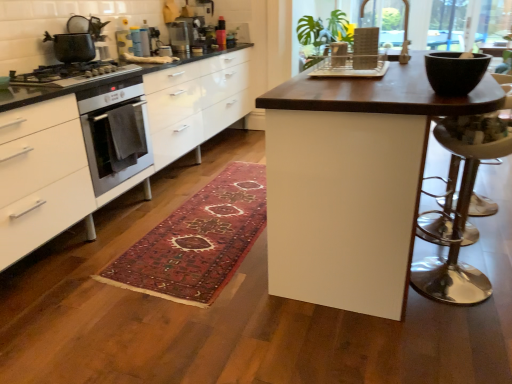
Identify the location of metallic silver toaster at upper center, positioned as the 2th appliance in front-to-back order. (140, 41).

The width and height of the screenshot is (512, 384). What do you see at coordinates (140, 41) in the screenshot? I see `metallic silver toaster at upper center, positioned as the 2th appliance in front-to-back order` at bounding box center [140, 41].

Locate an element on the screen. white glossy cabinets at left is located at coordinates (101, 146).

Locate an element on the screen. This screenshot has width=512, height=384. metallic silver toaster at upper center, positioned as the 2th appliance in front-to-back order is located at coordinates (140, 41).

Between point (501, 153) and point (364, 94), which one is positioned in front?

Positioned in front is point (364, 94).

Considering the sizes of objects polished silver bar stool at right and dark wood table at center in the image provided, who is bigger, polished silver bar stool at right or dark wood table at center?

dark wood table at center.

Considering the positions of objects polished silver bar stool at right and dark wood table at center in the image provided, who is behind, polished silver bar stool at right or dark wood table at center?

polished silver bar stool at right is more distant.

Is metallic silver toaster at upper center, the second appliance positioned from the top, in front of or behind dark wood table at center in the image?

metallic silver toaster at upper center, the second appliance positioned from the top, is positioned farther from the viewer than dark wood table at center.

This screenshot has height=384, width=512. Find the location of `table that appears below the metallic silver toaster at upper center, marked as the first appliance in a left-to-right arrangement (from a real-world perspective)`. table that appears below the metallic silver toaster at upper center, marked as the first appliance in a left-to-right arrangement (from a real-world perspective) is located at coordinates (352, 182).

Can you confirm if metallic silver toaster at upper center, the second appliance when ordered from back to front, is shorter than dark wood table at center?

Correct, metallic silver toaster at upper center, the second appliance when ordered from back to front, is not as tall as dark wood table at center.

Does matte black gas stove at left have a lesser width compared to translucent plastic blender at upper center, the second appliance positioned from the left?

In fact, matte black gas stove at left might be wider than translucent plastic blender at upper center, the second appliance positioned from the left.

Which object is positioned more to the left, matte black gas stove at left or translucent plastic blender at upper center, placed as the 2th appliance when sorted from right to left?

From the viewer's perspective, matte black gas stove at left appears more on the left side.

Are matte black gas stove at left and translucent plastic blender at upper center, placed as the 2th appliance when sorted from right to left, far apart?

Absolutely, matte black gas stove at left is distant from translucent plastic blender at upper center, placed as the 2th appliance when sorted from right to left.

From the image's perspective, does matte black gas stove at left appear lower than translucent plastic blender at upper center, placed as the 2th appliance when sorted from right to left?

Indeed, from the image's perspective, matte black gas stove at left is shown beneath translucent plastic blender at upper center, placed as the 2th appliance when sorted from right to left.

Can you confirm if wooden lattice at upper right is bigger than matte plastic dish rack at center, placed as the first appliance when sorted from bottom to top?

Yes.

From a real-world perspective, does wooden lattice at upper right stand above matte plastic dish rack at center, which is counted as the first appliance, starting from the front?

Yes, from a real-world perspective, wooden lattice at upper right is on top of matte plastic dish rack at center, which is counted as the first appliance, starting from the front.

Is wooden lattice at upper right facing away from matte plastic dish rack at center, which is counted as the 3th appliance, starting from the back?

No, matte plastic dish rack at center, which is counted as the 3th appliance, starting from the back, is not at the back of wooden lattice at upper right.

Consider the image. In the image, is dark wood table at center on the left side or the right side of metallic silver toaster at upper center, the second appliance when ordered from back to front?

Clearly, dark wood table at center is on the right of metallic silver toaster at upper center, the second appliance when ordered from back to front, in the image.

Is dark wood table at center oriented away from metallic silver toaster at upper center, acting as the 3th appliance starting from the right?

Yes, dark wood table at center's orientation is away from metallic silver toaster at upper center, acting as the 3th appliance starting from the right.

In the scene shown: Considering the relative sizes of dark wood table at center and metallic silver toaster at upper center, acting as the 3th appliance starting from the right, in the image provided, is dark wood table at center taller than metallic silver toaster at upper center, acting as the 3th appliance starting from the right,?

Indeed, dark wood table at center has a greater height compared to metallic silver toaster at upper center, acting as the 3th appliance starting from the right.

From a real-world perspective, does dark wood table at center stand above metallic silver toaster at upper center, the second appliance when ordered from back to front?

No, from a real-world perspective, dark wood table at center is not above metallic silver toaster at upper center, the second appliance when ordered from back to front.

Is metallic silver toaster at upper center, marked as the 2th appliance in a bottom-to-top arrangement, aimed at wooden lattice at upper right?

Yes, metallic silver toaster at upper center, marked as the 2th appliance in a bottom-to-top arrangement, is turned towards wooden lattice at upper right.

Could you measure the distance between metallic silver toaster at upper center, positioned as the 2th appliance in front-to-back order, and wooden lattice at upper right?

The distance of metallic silver toaster at upper center, positioned as the 2th appliance in front-to-back order, from wooden lattice at upper right is 6.46 feet.

Where is `the 1st appliance behind the wooden lattice at upper right, starting your count from the anchor`? This screenshot has width=512, height=384. the 1st appliance behind the wooden lattice at upper right, starting your count from the anchor is located at coordinates (140, 41).

Is carpeted rug at center in front of matte black gas stove at left?

Yes, carpeted rug at center is closer to the viewer.

How much distance is there between carpeted rug at center and matte black gas stove at left?

3.42 feet.

Considering the relative sizes of carpeted rug at center and matte black gas stove at left in the image provided, is carpeted rug at center bigger than matte black gas stove at left?

Yes.

Considering the positions of point (182, 235) and point (20, 74), is point (182, 235) closer or farther from the camera than point (20, 74)?

Point (182, 235).

Identify the location of bar stool below the dark wood table at center (from the image's perspective). The height and width of the screenshot is (384, 512). (458, 231).

Which appliance is the 2nd one when counting from the back of the dark wood table at center? Please provide its 2D coordinates.

[(140, 41)]

Which object lies further to the anchor point wooden lattice at upper right, metallic silver toaster at upper center, marked as the first appliance in a left-to-right arrangement, or matte black pot at upper left?

The object further to wooden lattice at upper right is matte black pot at upper left.

Based on their spatial positions, is wooden lattice at upper right or carpeted rug at center further from translucent plastic blender at upper center, arranged as the first appliance when viewed from the back?

Among the two, wooden lattice at upper right is located further to translucent plastic blender at upper center, arranged as the first appliance when viewed from the back.

Based on their spatial positions, is matte plastic dish rack at center, placed as the first appliance when sorted from bottom to top, or polished silver bar stool at right further from white glossy cabinets at left?

Among the two, polished silver bar stool at right is located further to white glossy cabinets at left.

In the scene shown: Looking at the image, which one is located closer to wooden lattice at upper right, black matte bowl at upper right or white glossy cabinets at left?

Based on the image, black matte bowl at upper right appears to be nearer to wooden lattice at upper right.

From the image, which object appears to be farther from polished silver bar stool at right, translucent plastic blender at upper center, arranged as the first appliance when viewed from the back, or matte black gas stove at left?

translucent plastic blender at upper center, arranged as the first appliance when viewed from the back, lies further to polished silver bar stool at right than the other object.

Consider the image. Estimate the real-world distances between objects in this image. Which object is further from white glossy cabinets at left, black matte bowl at upper right or carpeted rug at center?

The object further to white glossy cabinets at left is black matte bowl at upper right.

From the image, which object appears to be farther from matte black pot at upper left, wooden lattice at upper right or dark wood table at center?

wooden lattice at upper right lies further to matte black pot at upper left than the other object.

Estimate the real-world distances between objects in this image. Which object is closer to matte black gas stove at left, wooden lattice at upper right or matte black pot at upper left?

The object closer to matte black gas stove at left is matte black pot at upper left.

The height and width of the screenshot is (384, 512). I want to click on window screen between matte black pot at upper left and dark wood table at center from left to right, so click(405, 35).

The width and height of the screenshot is (512, 384). In order to click on bowl between matte black pot at upper left and wooden lattice at upper right from left to right in this screenshot , I will do `click(455, 72)`.

The width and height of the screenshot is (512, 384). I want to click on cabinetry between matte black gas stove at left and wooden lattice at upper right in the horizontal direction, so click(101, 146).

Where is `appliance between carpeted rug at center and polished silver bar stool at right`? This screenshot has height=384, width=512. appliance between carpeted rug at center and polished silver bar stool at right is located at coordinates (365, 48).